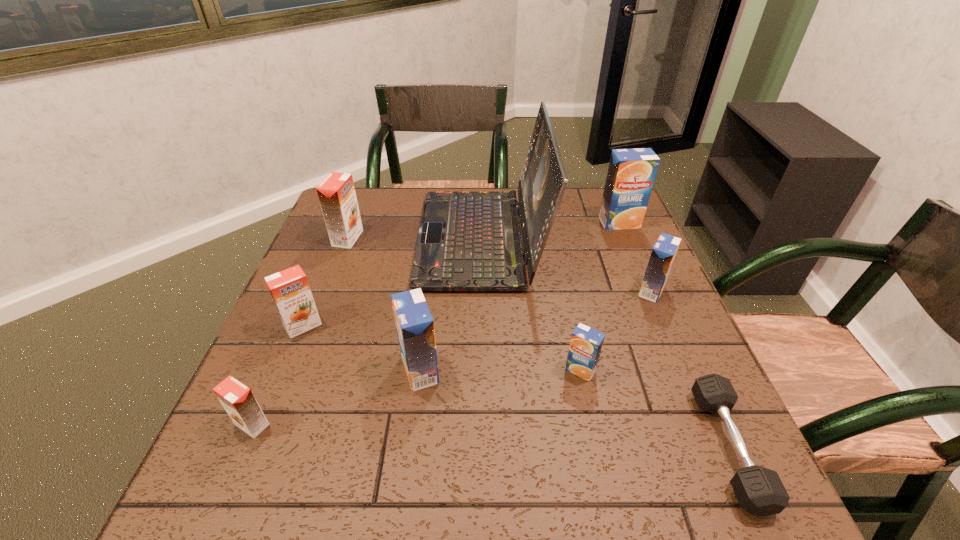
In order to click on vacant area that lies between the biggest blue orange_juice and the fourth orange juice from left to right in this screenshot , I will do `click(519, 296)`.

I want to click on unoccupied position between the second biggest blue orange_juice and the biggest orange orange juice, so click(x=384, y=305).

You are a GUI agent. You are given a task and a screenshot of the screen. Output one action in this format:
    pyautogui.click(x=<x>, y=<y>)
    Task: Click on the blank region between the second smallest blue orange_juice and the dumbbell
    The width and height of the screenshot is (960, 540).
    Given the screenshot: What is the action you would take?
    pyautogui.click(x=689, y=369)

Where is `vacant area that lies between the leftmost blue orange_juice and the tallest object`? The image size is (960, 540). vacant area that lies between the leftmost blue orange_juice and the tallest object is located at coordinates (450, 305).

Identify the location of free space between the third farthest orange juice and the dumbbell. (689, 369).

Where is `free area in between the biggest blue orange_juice and the second smallest blue orange_juice`? free area in between the biggest blue orange_juice and the second smallest blue orange_juice is located at coordinates (x=636, y=257).

Choose which object is the nearest neighbor to the second smallest orange orange juice. Please provide its 2D coordinates. Your answer should be formatted as a tuple, i.e. [(x, y)], where the tuple contains the x and y coordinates of a point satisfying the conditions above.

[(237, 399)]

Locate which object ranks sixth in proximity to the dumbbell. Please provide its 2D coordinates. Your answer should be formatted as a tuple, i.e. [(x, y)], where the tuple contains the x and y coordinates of a point satisfying the conditions above.

[(290, 291)]

Choose which orange juice is the third nearest neighbor to the smallest orange orange juice. Please provide its 2D coordinates. Your answer should be formatted as a tuple, i.e. [(x, y)], where the tuple contains the x and y coordinates of a point satisfying the conditions above.

[(337, 196)]

Locate which orange juice ranks in proximity to the fifth nearest orange juice. Please provide its 2D coordinates. Your answer should be formatted as a tuple, i.e. [(x, y)], where the tuple contains the x and y coordinates of a point satisfying the conditions above.

[(631, 173)]